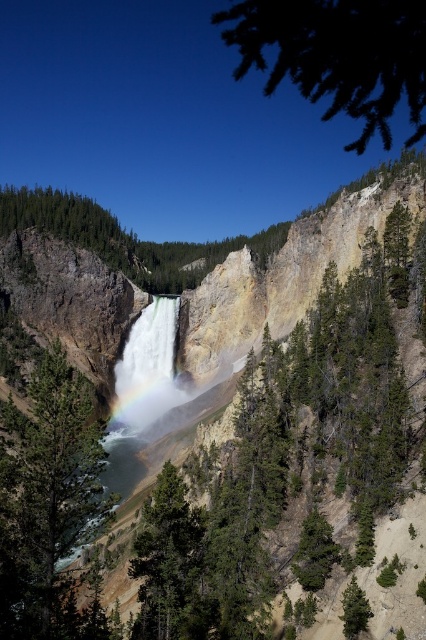
Between green leafy branch at upper right and green matte tree at lower right, which one appears on the right side from the viewer's perspective?

From the viewer's perspective, green leafy branch at upper right appears more on the right side.

Can you confirm if green leafy branch at upper right is smaller than green matte tree at lower right?

No, green leafy branch at upper right is not smaller than green matte tree at lower right.

Which is behind, point (362, 3) or point (344, 618)?

Positioned behind is point (344, 618).

Find the location of `green leafy branch at upper right`. green leafy branch at upper right is located at coordinates (337, 54).

Who is taller, green rough bark tree at lower center or green matte tree at lower right?

green rough bark tree at lower center is taller.

Is green rough bark tree at lower center positioned behind green matte tree at lower right?

Yes, green rough bark tree at lower center is further from the viewer.

This screenshot has height=640, width=426. Describe the element at coordinates (169, 564) in the screenshot. I see `green rough bark tree at lower center` at that location.

The height and width of the screenshot is (640, 426). What are the coordinates of `green rough bark tree at lower center` in the screenshot? It's located at (169, 564).

Between point (46, 433) and point (132, 378), which one is positioned in front?

Point (46, 433)

Can you confirm if green matte tree at center is wider than rainbow-colored water at center?

Indeed, green matte tree at center has a greater width compared to rainbow-colored water at center.

The image size is (426, 640). Identify the location of green matte tree at center. (48, 504).